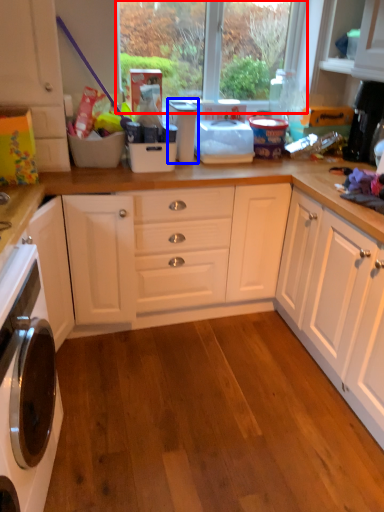
Question: Which of the following is the closest to the observer, window screen (highlighted by a red box) or appliance (highlighted by a blue box)?

Choices:
 (A) window screen
 (B) appliance

Answer: (B)